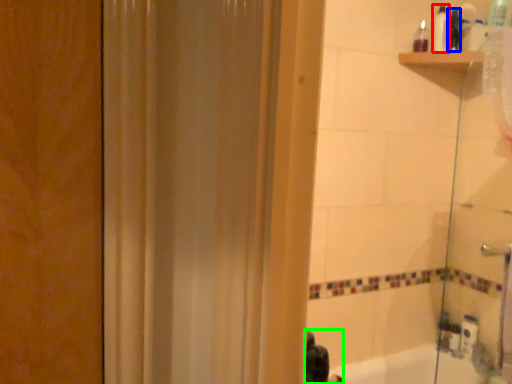
Question: Based on their relative distances, which object is farther from toiletry (highlighted by a red box)? Choose from toiletry (highlighted by a blue box) and person (highlighted by a green box).

Choices:
 (A) toiletry
 (B) person

Answer: (B)